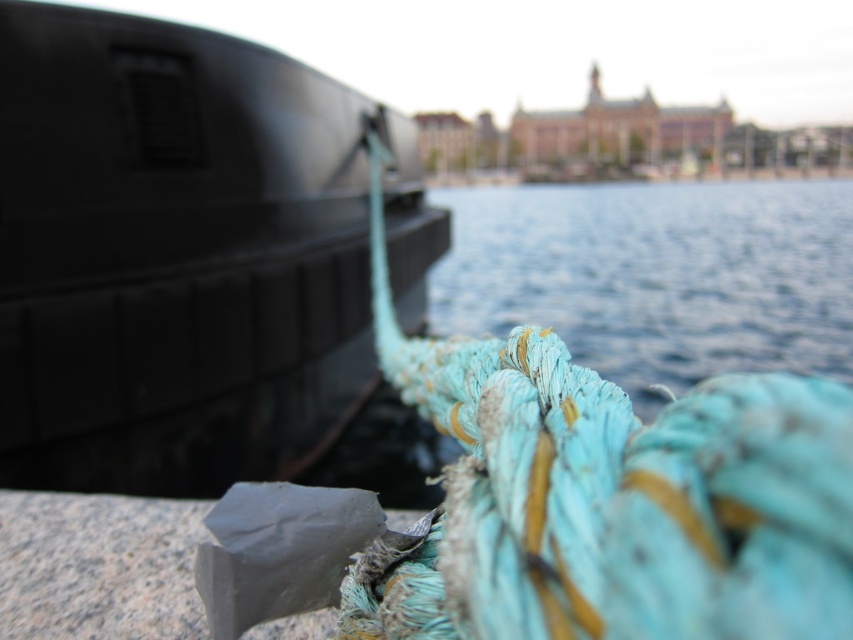
Question: Which point is farther from the camera taking this photo?

Choices:
 (A) (614, 324)
 (B) (114, 140)

Answer: (A)

Question: Can you confirm if matte black boat at left is wider than blue fabric water at center?

Choices:
 (A) no
 (B) yes

Answer: (A)

Question: From the image, what is the correct spatial relationship of matte black boat at left in relation to blue fabric water at center?

Choices:
 (A) right
 (B) left

Answer: (B)

Question: From the image, what is the correct spatial relationship of matte black boat at left in relation to blue fabric water at center?

Choices:
 (A) left
 (B) right

Answer: (A)

Question: Which point is farther to the camera?

Choices:
 (A) (96, 252)
 (B) (631, 205)

Answer: (B)